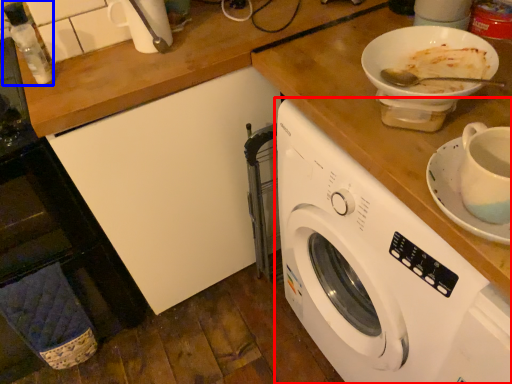
Question: Which object appears farthest to the camera in this image, washing machine (highlighted by a red box) or bottle (highlighted by a blue box)?

Choices:
 (A) washing machine
 (B) bottle

Answer: (B)